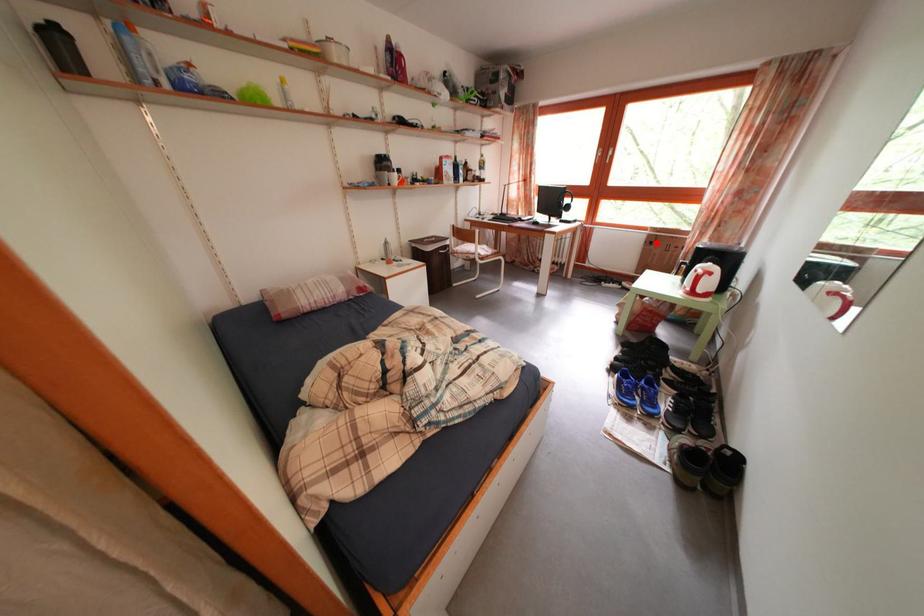
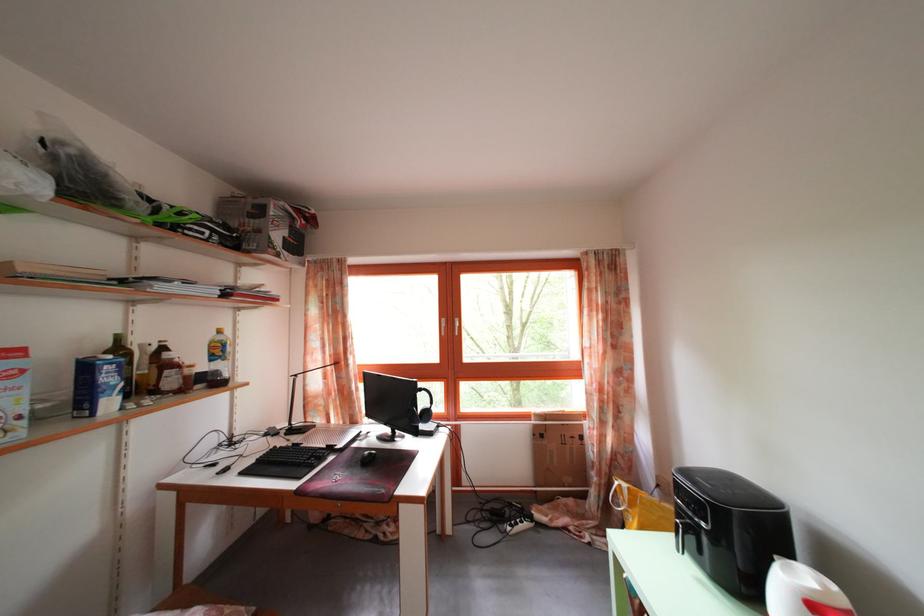
Question: I am providing you with two images of the same scene from different viewpoints. Given a red point in image1, look at the same physical point in image2. Is it:

Choices:
 (A) Closer to the viewpoint
 (B) Farther from the viewpoint

Answer: (B)